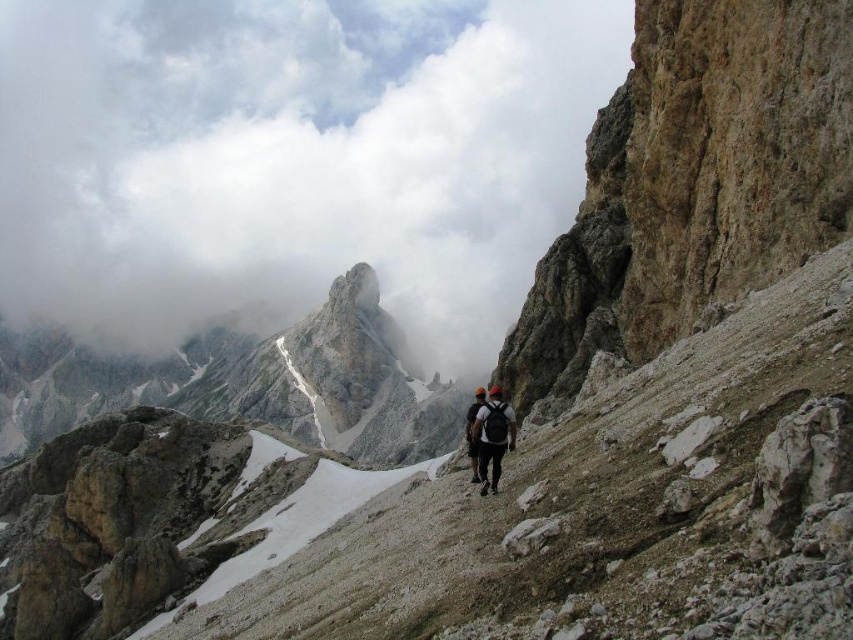
You are a hiker looking at the mountain scene. You notice the dark gray backpack at center and the white fluffy cloud at upper center. Which object is closer to you, the observer?

The white fluffy cloud at upper center is closer to you because the dark gray backpack at center is behind it.

You are a drone operator trying to capture a photo of the white fluffy cloud at upper center. From your current position, you need to adjust your camera to focus on the cloud. What are the coordinates you should aim for?

The white fluffy cloud at upper center is located at point (292, 160), so you should aim your camera at those coordinates to capture it.

You are a hiker planning to take a photo of the black fabric backpack at center and the white fluffy cloud at upper center. Which object should you zoom in on to capture the entire scene without cropping either of them?

The white fluffy cloud at upper center is wider than the black fabric backpack at center, so you should zoom in on the white fluffy cloud at upper center to ensure both objects fit in the frame.